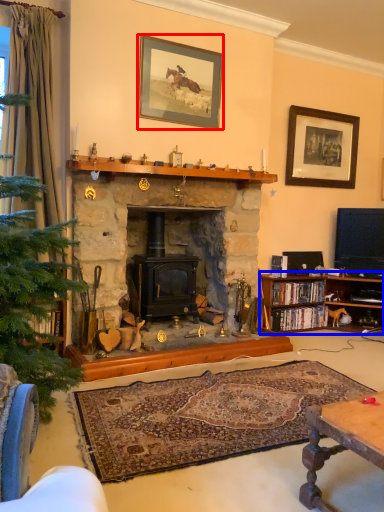
Question: Which object is further to the camera taking this photo, picture frame (highlighted by a red box) or cabinetry (highlighted by a blue box)?

Choices:
 (A) picture frame
 (B) cabinetry

Answer: (B)